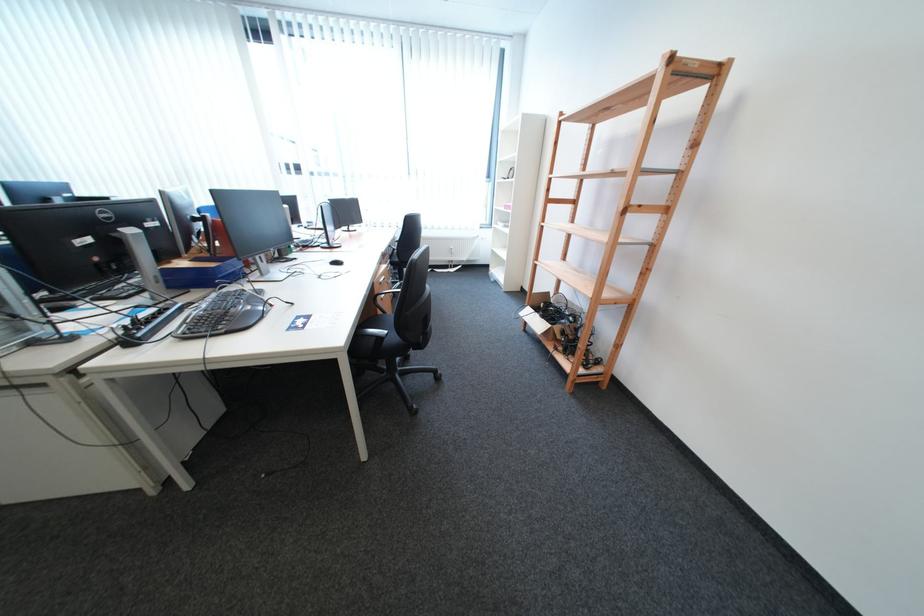
The location [335,262] corresponds to which object?

It corresponds to the black computer mouse in the image.